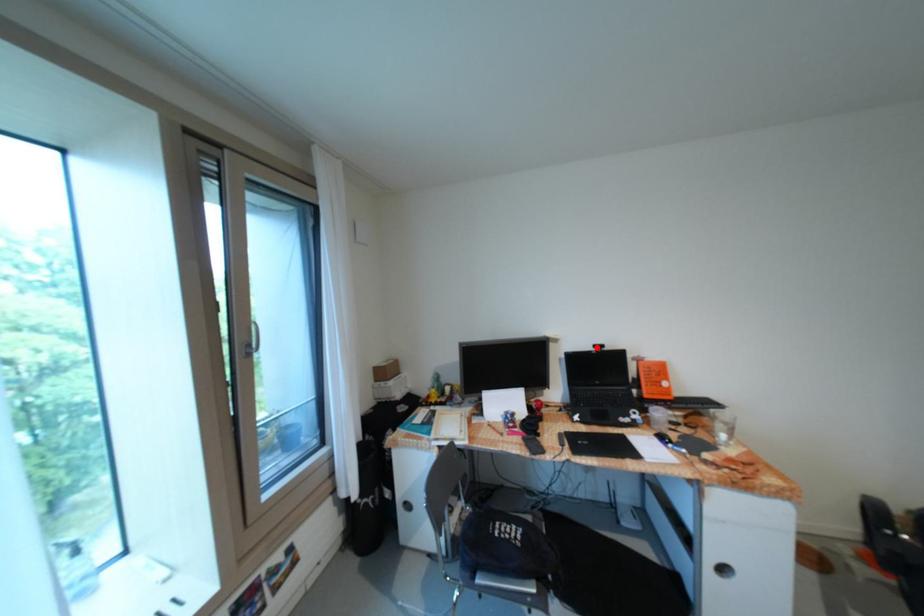
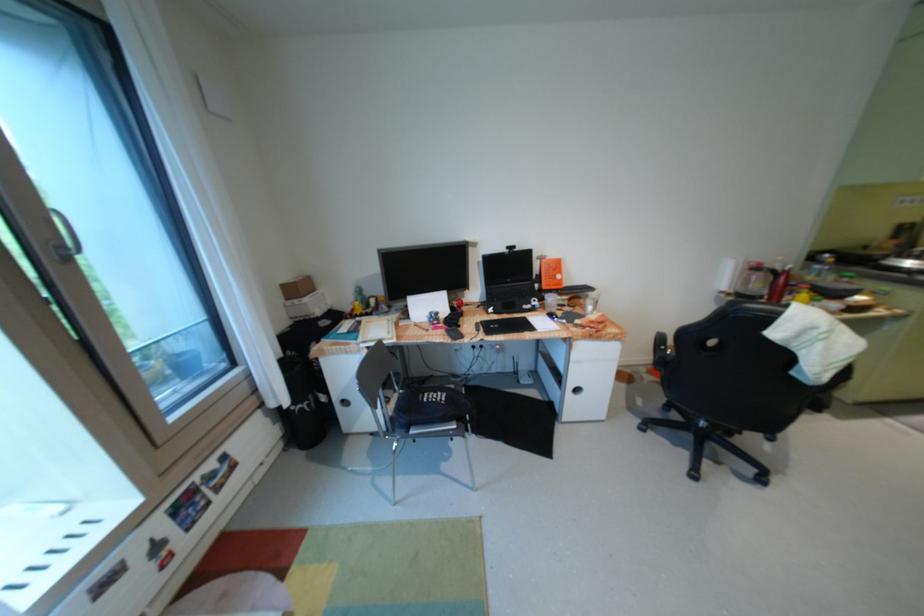
The point at the highlighted location is marked in the first image. Where is the corresponding point in the second image?

(512, 249)